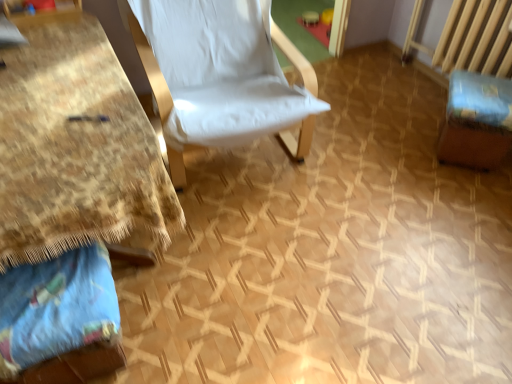
The height and width of the screenshot is (384, 512). I want to click on vacant area located to the right-hand side of white fabric chair at center, so click(x=378, y=156).